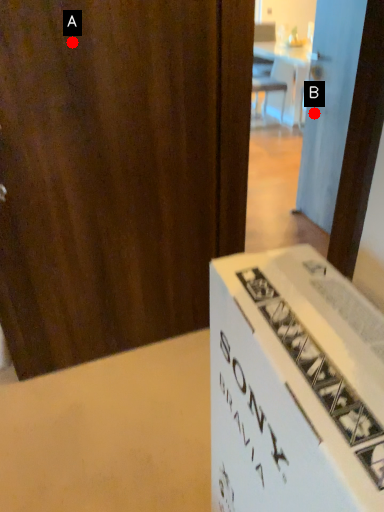
Question: Two points are circled on the image, labeled by A and B beside each circle. Among these points, which one is farthest from the camera?

Choices:
 (A) A is further
 (B) B is further

Answer: (B)